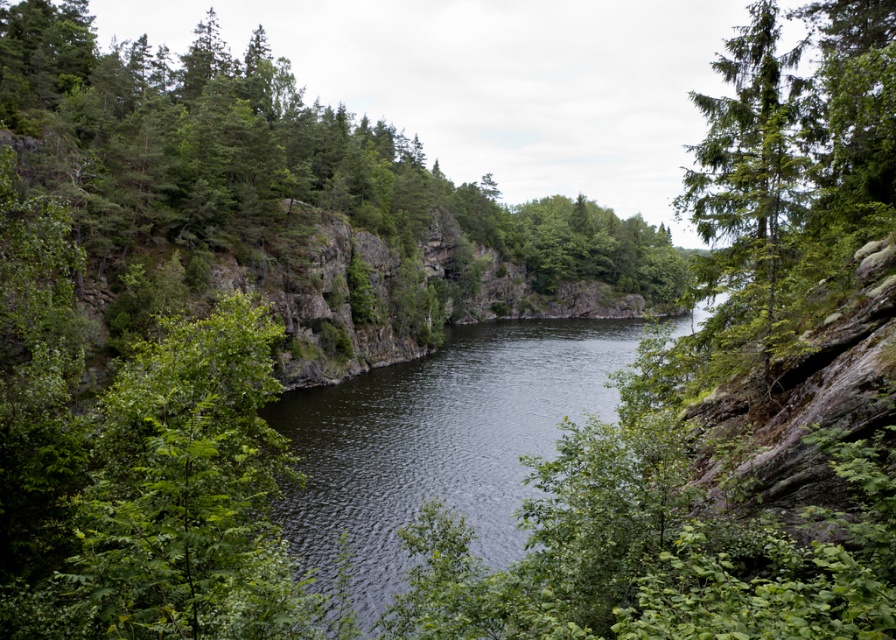
Question: Which object appears closest to the camera in this image?

Choices:
 (A) dark water at center
 (B) green matte tree at upper right

Answer: (B)

Question: From the image, what is the correct spatial relationship of dark water at center in relation to green matte tree at upper right?

Choices:
 (A) above
 (B) below

Answer: (B)

Question: Is dark water at center in front of green matte tree at upper right?

Choices:
 (A) no
 (B) yes

Answer: (A)

Question: Which object appears farthest from the camera in this image?

Choices:
 (A) dark water at center
 (B) green matte tree at upper right

Answer: (A)

Question: Is dark water at center behind green matte tree at upper right?

Choices:
 (A) yes
 (B) no

Answer: (A)